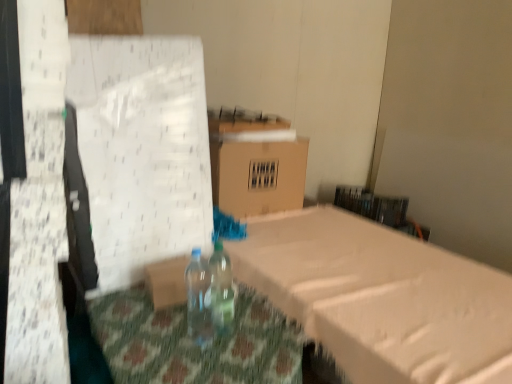
The width and height of the screenshot is (512, 384). Identify the location of vacant area that lies in front of transparent plastic bottle at center, the first bottle when ordered from right to left. (230, 357).